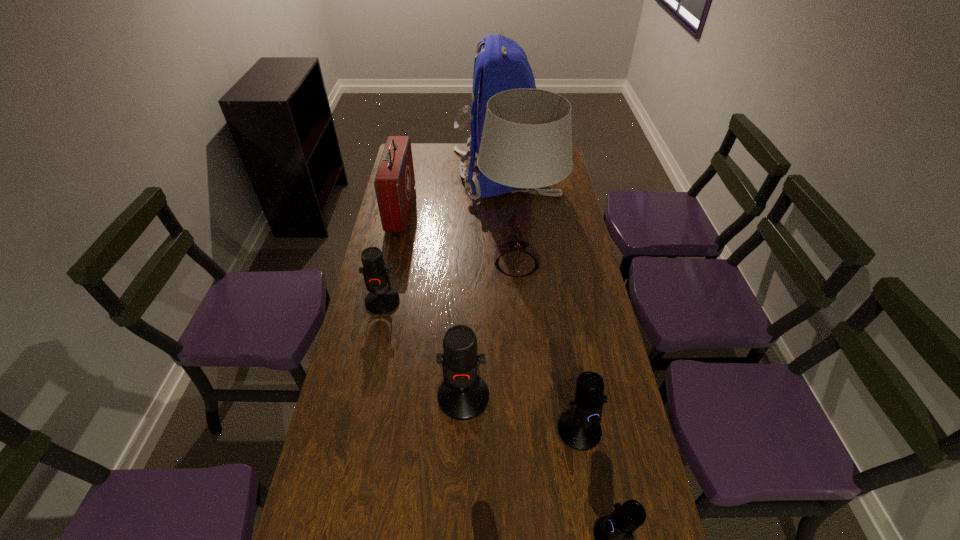
Locate an element on the screen. This screenshot has height=540, width=960. red microphone that can be found as the closest to the farther black microphone is located at coordinates (463, 395).

I want to click on free space that satisfies the following two spatial constraints: 1. on the front-facing side of the table lamp; 2. on the side of the leftmost microphone with the red ring, so click(x=520, y=301).

The image size is (960, 540). I want to click on vacant space that satisfies the following two spatial constraints: 1. on the front-facing side of the table lamp; 2. on the side of the tallest microphone with the red ring, so click(x=528, y=397).